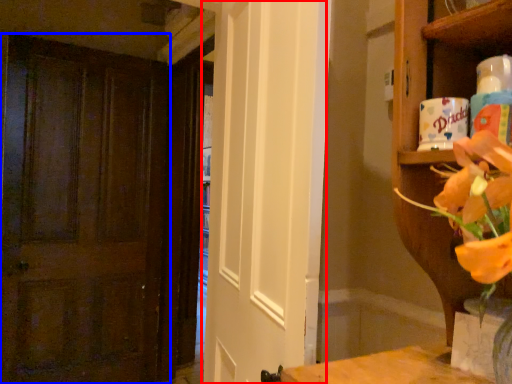
Question: Which point is further to the camera, screen door (highlighted by a red box) or door (highlighted by a blue box)?

Choices:
 (A) screen door
 (B) door

Answer: (B)